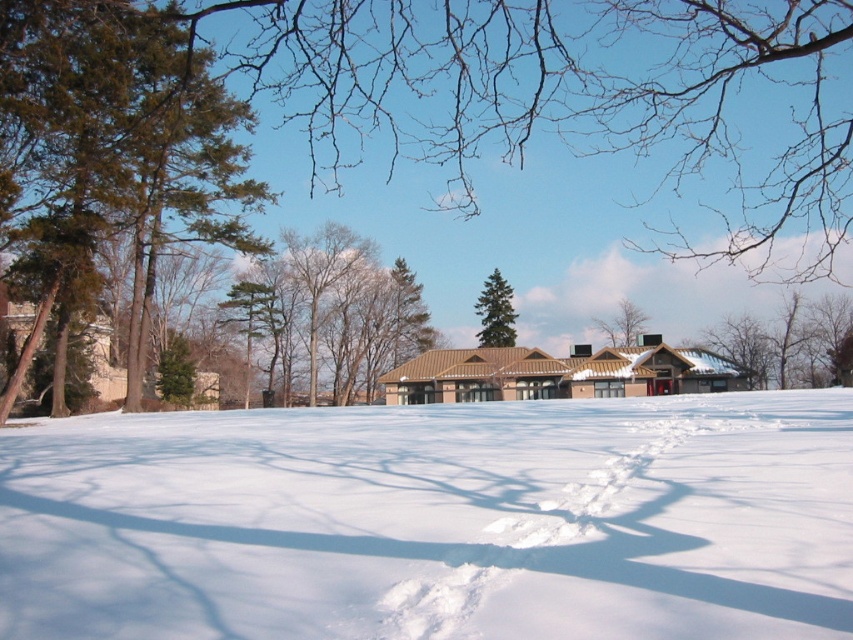
You are standing at the origin point in the winter scene. You want to walk towards the green matte tree at center. What direction should you move in?

Since the green matte tree at center is located at point 2D coordinates of 0.489 on the x axis and 0.581 on the y axis, you should move northeast to reach it.

You are standing at the center of the snow scene and want to walk towards the green evergreen tree at left. Which direction should you face to head directly towards it?

The green evergreen tree at left is located at point (111, 150), which is to the left side of the scene. Therefore, you should face towards the left direction to head directly towards the green evergreen tree at left.